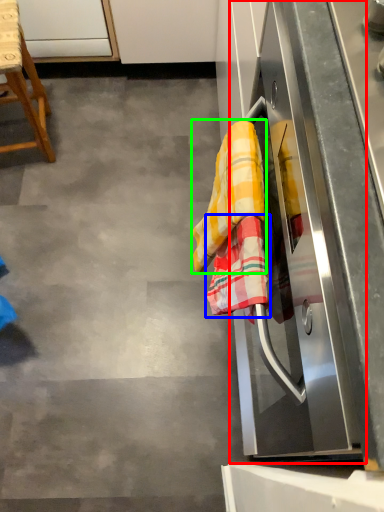
Question: Which is nearer to the oven (highlighted by a red box)? beach towel (highlighted by a blue box) or material (highlighted by a green box).

Choices:
 (A) beach towel
 (B) material

Answer: (A)